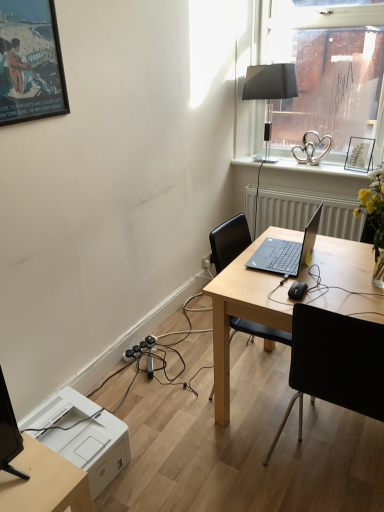
Image resolution: width=384 pixels, height=512 pixels. I want to click on vacant space that is to the left of black plastic mouse at lower right, so click(272, 293).